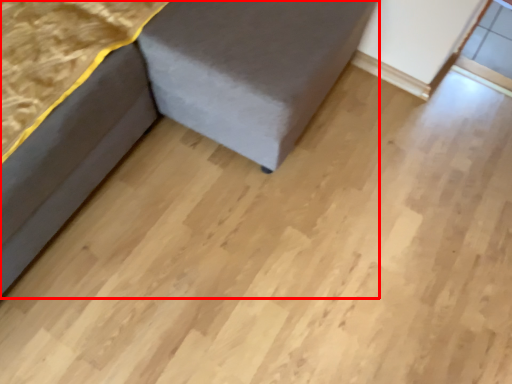
Question: Where is furniture (annotated by the red box) located in relation to furniture in the image?

Choices:
 (A) left
 (B) right

Answer: (B)